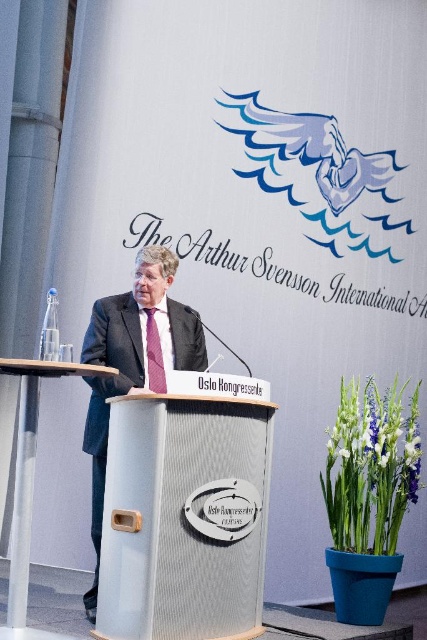
In the scene shown: You are attending the event and want to approach the speaker to ask a question. You see the matte silver podium at center and the dark gray suit at center. Which object is closer to your right side as you face the stage?

The matte silver podium at center is to the right of the dark gray suit at center, so as you face the stage, the podium would be on your right side closer to you.

Looking at this image, you are an event photographer at the Arthur Svensson International event. You need to capture a closeup shot of the speaker while ensuring both the dark gray suit at center and the pink satin tie at center are visible. Which part of the speaker should you focus on to include both items in the frame?

You should focus on the upper body of the speaker because the dark gray suit at center is located below the pink satin tie at center, so capturing the upper body will include both the suit and the tie.